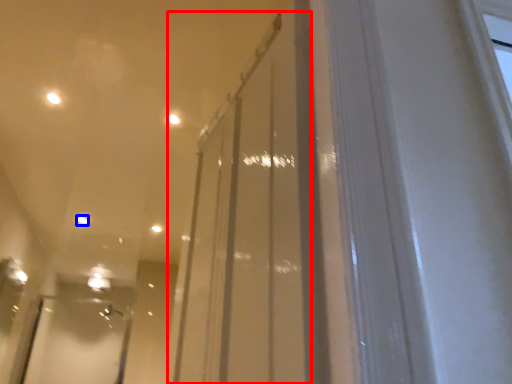
Question: Which of the following is the farthest to the observer, glass door (highlighted by a red box) or light (highlighted by a blue box)?

Choices:
 (A) glass door
 (B) light

Answer: (B)